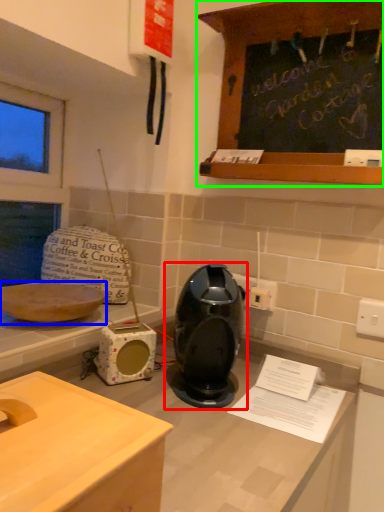
Question: Which object is positioned farthest from home appliance (highlighted by a red box)? Select from kitchen appliance (highlighted by a blue box) and cabinetry (highlighted by a green box).

Choices:
 (A) kitchen appliance
 (B) cabinetry

Answer: (B)